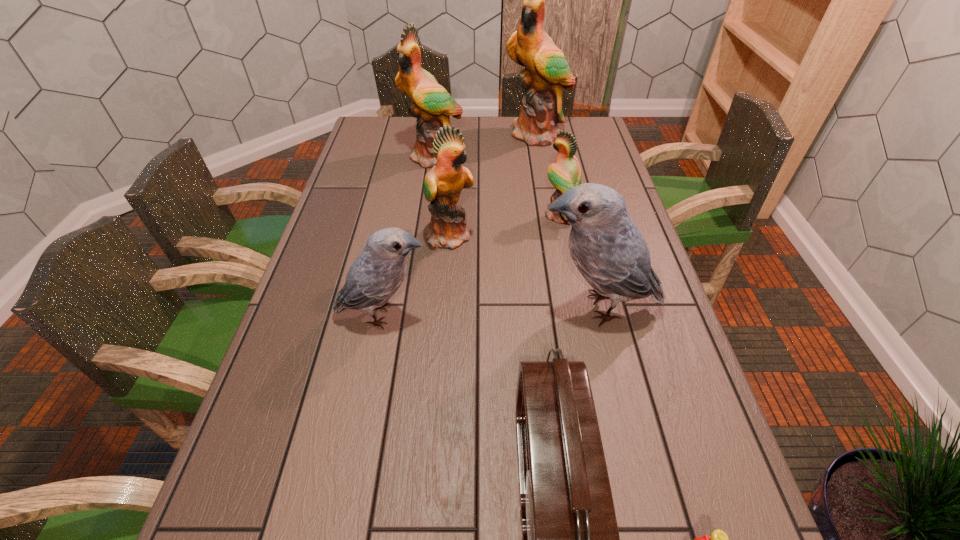
Identify the location of the tallest object. (546, 71).

At what (x,y) coordinates should I click in order to perform the action: click on the tallest parrot. Please return your answer as a coordinate pair (x, y). The height and width of the screenshot is (540, 960). Looking at the image, I should click on (546, 71).

Where is `the second biggest green parrot`? the second biggest green parrot is located at coordinates (432, 105).

You are a GUI agent. You are given a task and a screenshot of the screen. Output one action in this format:
    pyautogui.click(x=<x>, y=<y>)
    Task: Click on the seventh shortest object
    The height and width of the screenshot is (540, 960).
    Given the screenshot: What is the action you would take?
    pyautogui.click(x=432, y=105)

Locate an element on the screen. the second smallest green parrot is located at coordinates (443, 184).

Where is `the bigger gray parrot`? the bigger gray parrot is located at coordinates (607, 248).

Image resolution: width=960 pixels, height=540 pixels. I want to click on the smallest green parrot, so pos(565,174).

The image size is (960, 540). In order to click on the left gray parrot in this screenshot , I will do `click(374, 277)`.

The width and height of the screenshot is (960, 540). I want to click on free space located 0.260m on the front-facing side of the biggest green parrot, so click(x=547, y=190).

At what (x,y) coordinates should I click in order to perform the action: click on blank space located 0.140m on the front-facing side of the seventh shortest object. Please return your answer as a coordinate pair (x, y). Image resolution: width=960 pixels, height=540 pixels. Looking at the image, I should click on (428, 195).